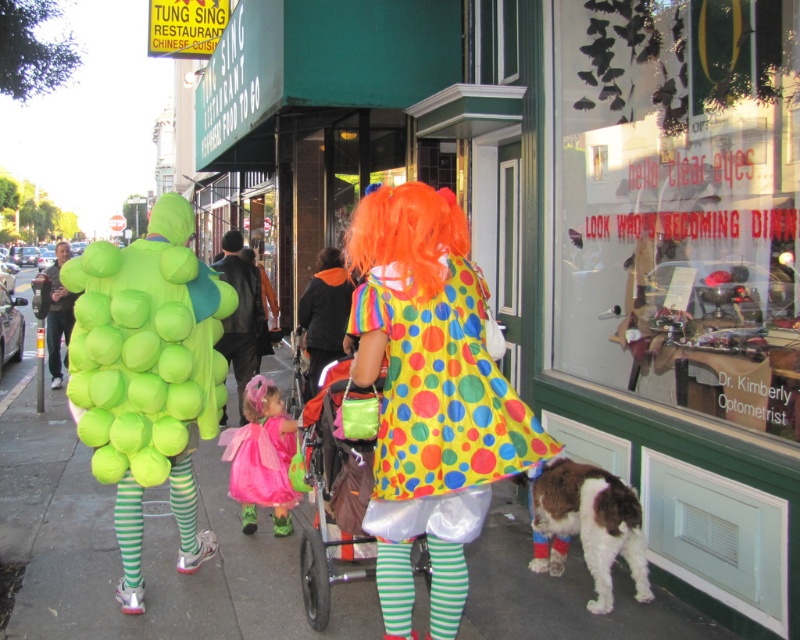
How far apart are clear glass window at upper right and polka dot fabric clown dress at center?

A distance of 2.30 meters exists between clear glass window at upper right and polka dot fabric clown dress at center.

Does clear glass window at upper right have a lesser height compared to polka dot fabric clown dress at center?

No, clear glass window at upper right is not shorter than polka dot fabric clown dress at center.

Between point (574, 154) and point (404, 400), which one is positioned in front?

Point (404, 400) is in front.

Find the location of a particular element. The height and width of the screenshot is (640, 800). clear glass window at upper right is located at coordinates (680, 204).

Can you confirm if polka dot fabric clown dress at center is bigger than polyester fabric stroller at center?

Indeed, polka dot fabric clown dress at center has a larger size compared to polyester fabric stroller at center.

The width and height of the screenshot is (800, 640). Describe the element at coordinates (429, 396) in the screenshot. I see `polka dot fabric clown dress at center` at that location.

Between point (484, 376) and point (318, 444), which one is positioned behind?

The point (318, 444) is more distant.

Locate an element on the screen. The width and height of the screenshot is (800, 640). polka dot fabric clown dress at center is located at coordinates (429, 396).

Is white fluffy dog at lower right below rainbow polka dot dress at center?

Yes.

Between point (592, 556) and point (310, 387), which one is positioned behind?

Positioned behind is point (310, 387).

You are a GUI agent. You are given a task and a screenshot of the screen. Output one action in this format:
    pyautogui.click(x=<x>, y=<y>)
    Task: Click on the white fluffy dog at lower right
    The height and width of the screenshot is (640, 800).
    Given the screenshot: What is the action you would take?
    592,522